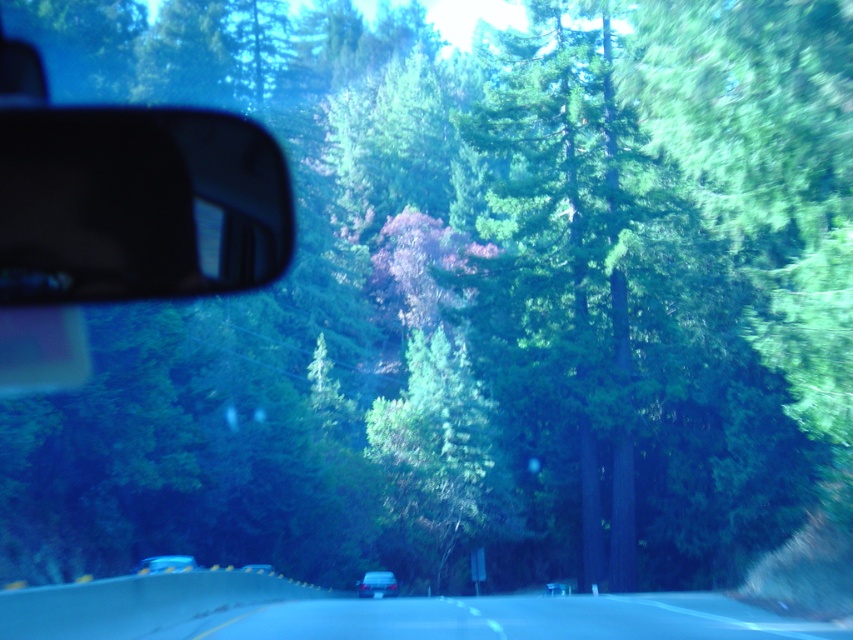
Question: Considering the relative positions of smooth asphalt road at center and metallic blue car at center in the image provided, where is smooth asphalt road at center located with respect to metallic blue car at center?

Choices:
 (A) left
 (B) right

Answer: (B)

Question: Which of these objects is positioned closest to the smooth asphalt road at center?

Choices:
 (A) black glossy view mirror at left
 (B) metallic silver sedan at center
 (C) metallic blue car at center
 (D) matte black car at center

Answer: (B)

Question: Which of the following is the farthest from the observer?

Choices:
 (A) metallic blue car at center
 (B) black glossy view mirror at left
 (C) smooth asphalt road at center
 (D) metallic silver sedan at center

Answer: (A)

Question: Is black glossy view mirror at left above matte black car at center?

Choices:
 (A) yes
 (B) no

Answer: (A)

Question: Does matte black car at center appear under metallic silver sedan at center?

Choices:
 (A) no
 (B) yes

Answer: (B)

Question: Which point is farther from the camera taking this photo?

Choices:
 (A) (360, 586)
 (B) (242, 566)
 (C) (477, 484)
 (D) (152, 572)

Answer: (C)